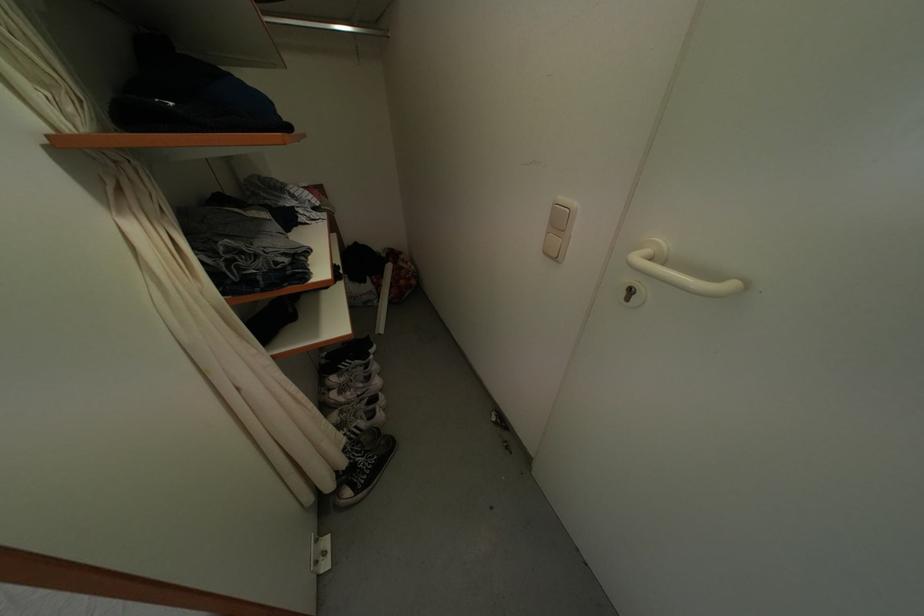
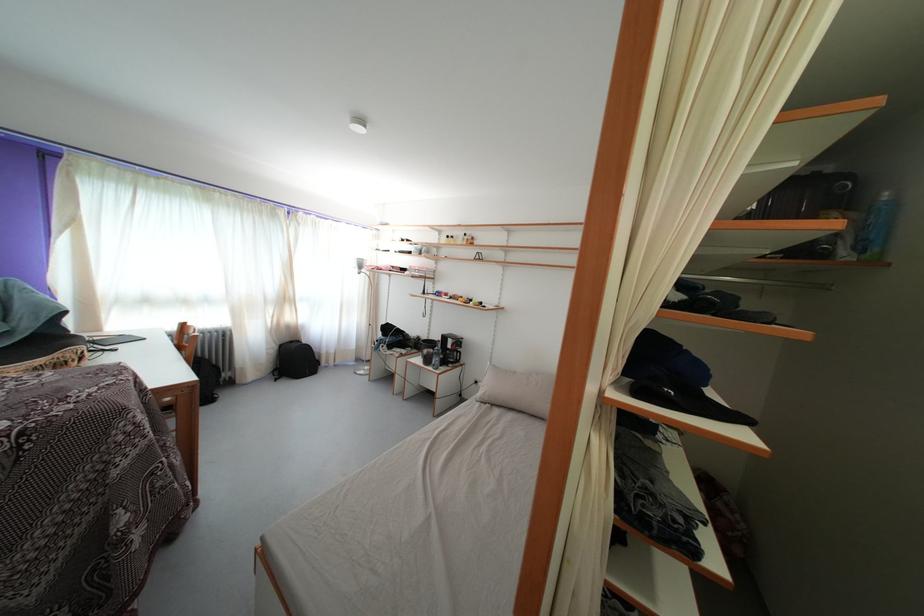
Question: How did the camera likely rotate?

Choices:
 (A) Left
 (B) Right
 (C) Up
 (D) Down

Answer: (A)